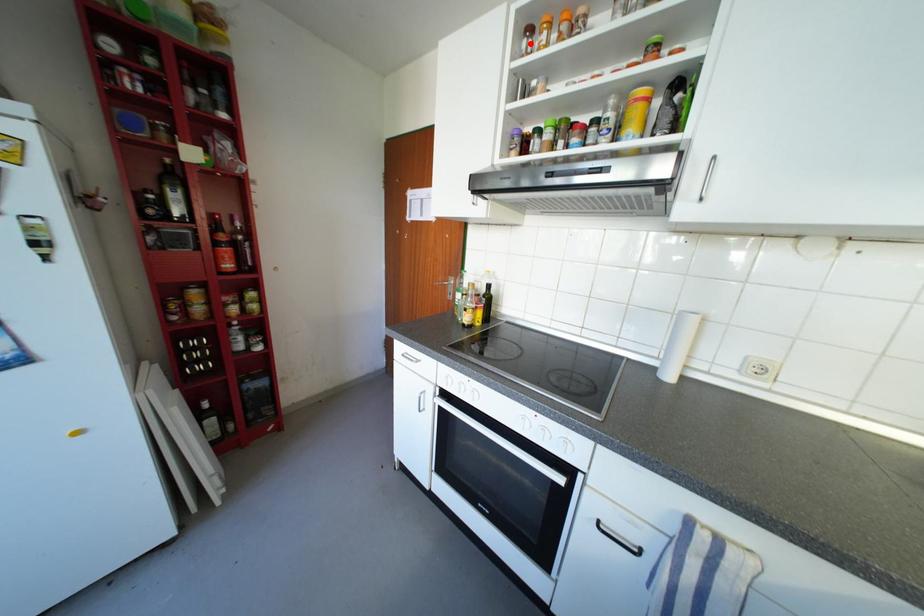
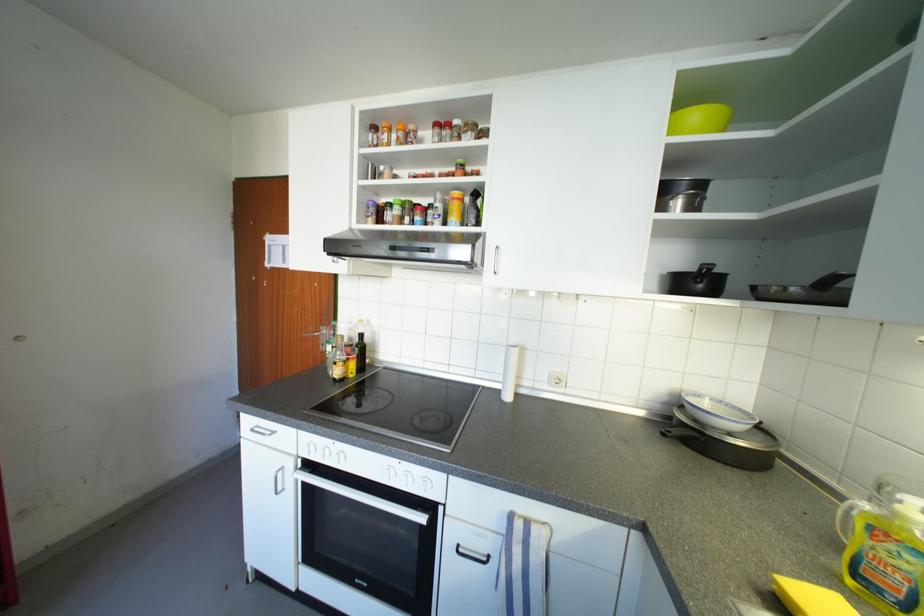
The point at the highlighted location is marked in the first image. Where is the corresponding point in the second image?

(377, 138)